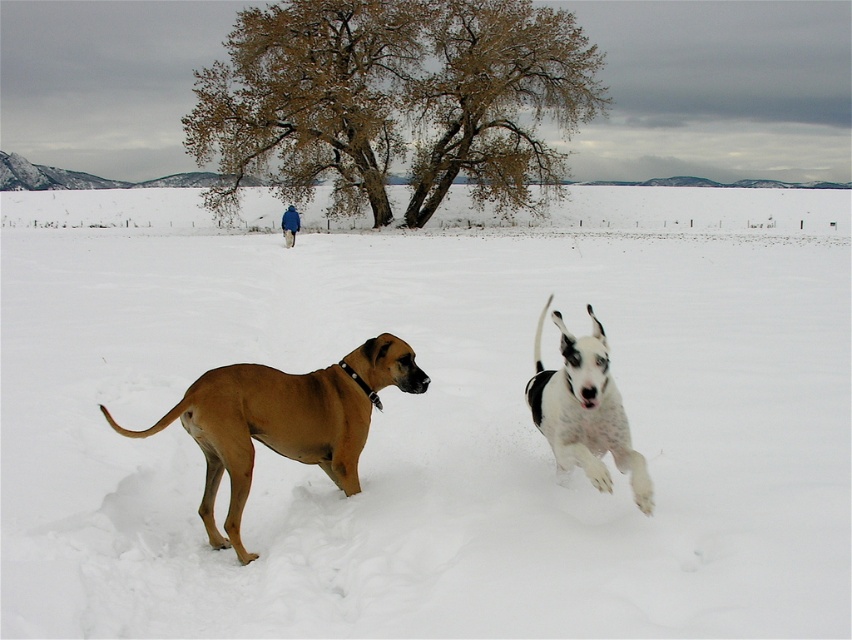
Question: Is brown leafy tree at upper center behind brown smooth dog at center?

Choices:
 (A) yes
 (B) no

Answer: (A)

Question: Which of these objects is positioned farthest from the blue fleece jacket at center?

Choices:
 (A) brown smooth dog at center
 (B) white fluffy snow at center
 (C) white speckled fur at center
 (D) brown leafy tree at upper center

Answer: (C)

Question: Among these points, which one is nearest to the camera?

Choices:
 (A) (571, 456)
 (B) (296, 228)
 (C) (210, 193)

Answer: (A)

Question: Does white speckled fur at center have a lesser width compared to blue fleece jacket at center?

Choices:
 (A) yes
 (B) no

Answer: (A)

Question: Which object appears farthest from the camera in this image?

Choices:
 (A) brown smooth dog at center
 (B) white speckled fur at center
 (C) white fluffy snow at center

Answer: (A)

Question: Does brown leafy tree at upper center have a greater width compared to brown smooth dog at center?

Choices:
 (A) yes
 (B) no

Answer: (A)